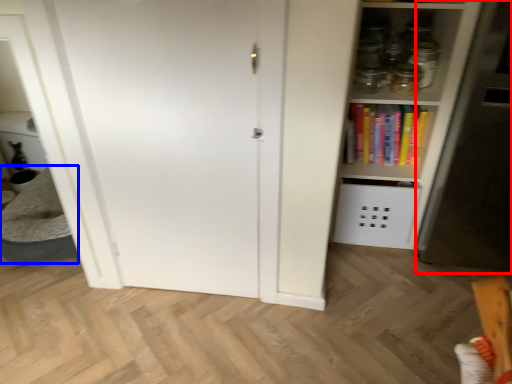
Question: Which point is further to the camera, fridge (highlighted by a red box) or table (highlighted by a blue box)?

Choices:
 (A) fridge
 (B) table

Answer: (B)